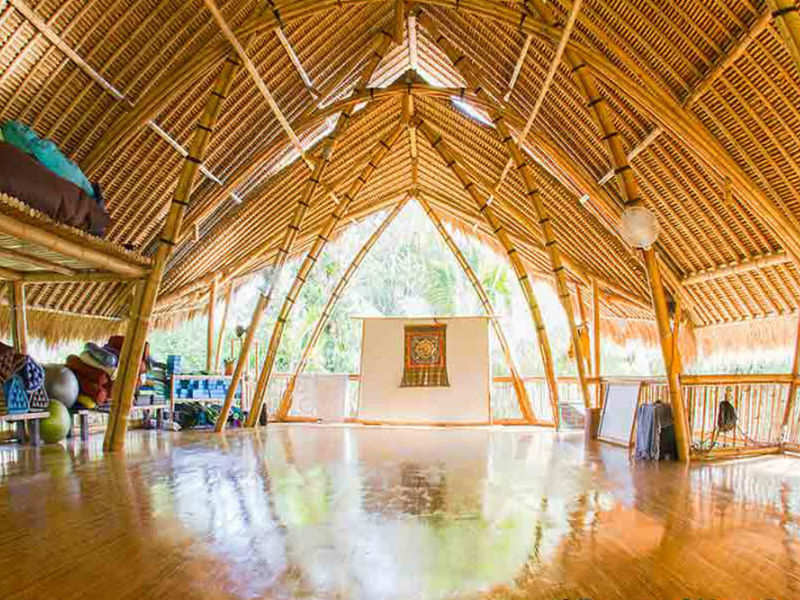
This screenshot has width=800, height=600. I want to click on fan, so click(x=634, y=225).